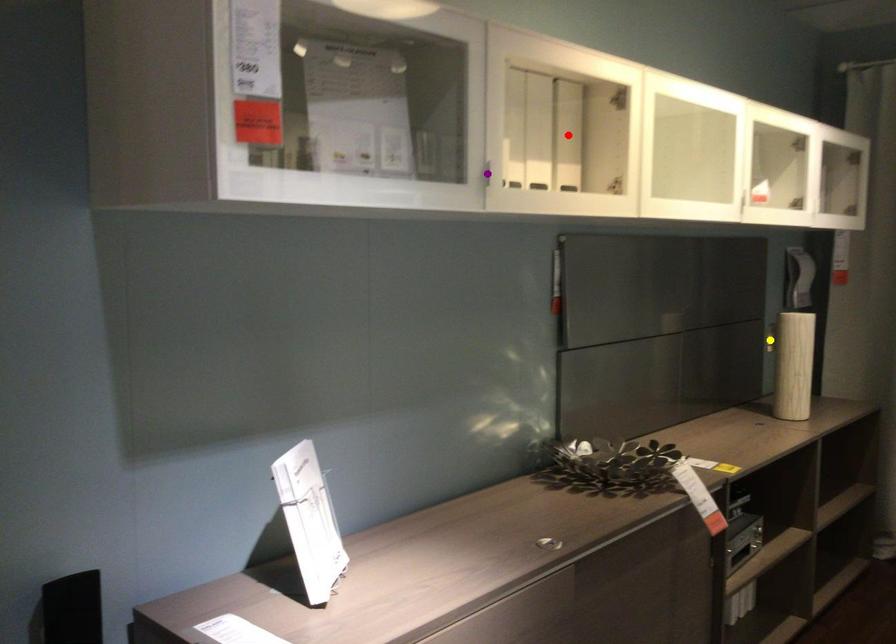
Order these from farthest to nearest:
yellow point | purple point | red point

yellow point < red point < purple point